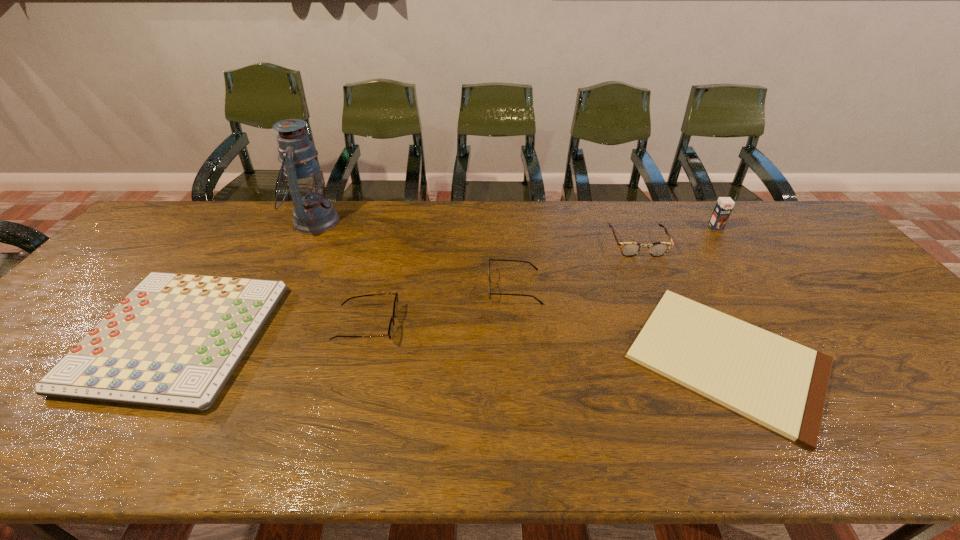
Locate an element on the screen. lantern is located at coordinates (312, 215).

Where is `the second tallest object`? Image resolution: width=960 pixels, height=540 pixels. the second tallest object is located at coordinates (724, 205).

Image resolution: width=960 pixels, height=540 pixels. Find the location of `the farthest spectacles`. the farthest spectacles is located at coordinates (629, 249).

Where is `the fourth object from right to left`? The image size is (960, 540). the fourth object from right to left is located at coordinates (536, 268).

Find the location of `the second spectacles from right to left`. the second spectacles from right to left is located at coordinates click(536, 268).

Where is `the nearest spectacles`? This screenshot has height=540, width=960. the nearest spectacles is located at coordinates coord(395,307).

Where is `the third object from left to right`? Image resolution: width=960 pixels, height=540 pixels. the third object from left to right is located at coordinates (395, 307).

Identify the location of gameboard. (174, 341).

You are a GUI agent. You are given a task and a screenshot of the screen. Output one action in this format:
    pyautogui.click(x=<x>, y=<y>)
    Task: Click on the shortest object
    
    Given the screenshot: What is the action you would take?
    pyautogui.click(x=782, y=385)

I want to click on vacant space situated 0.140m on the front-facing side of the lantern, so [380, 222].